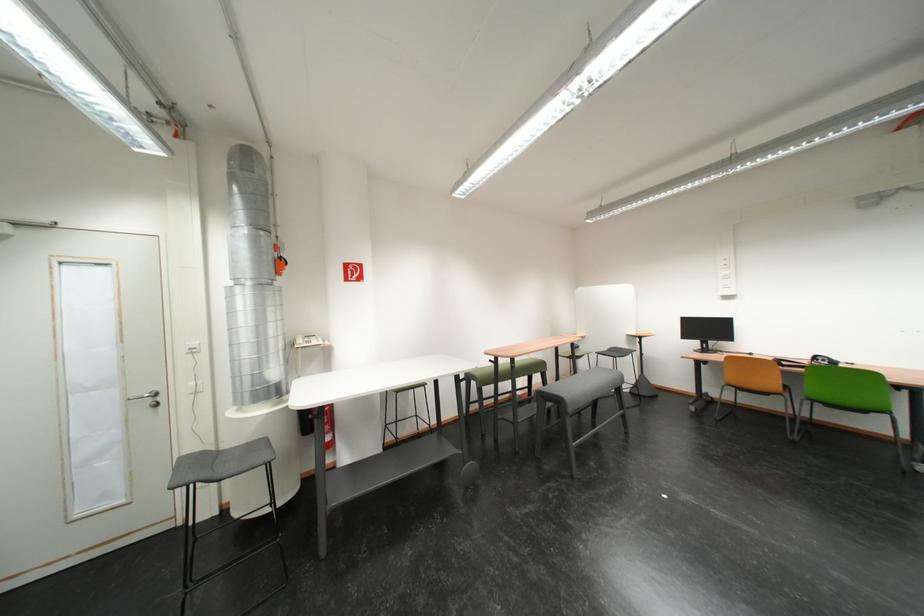
The width and height of the screenshot is (924, 616). What do you see at coordinates (148, 398) in the screenshot? I see `the silver door handle` at bounding box center [148, 398].